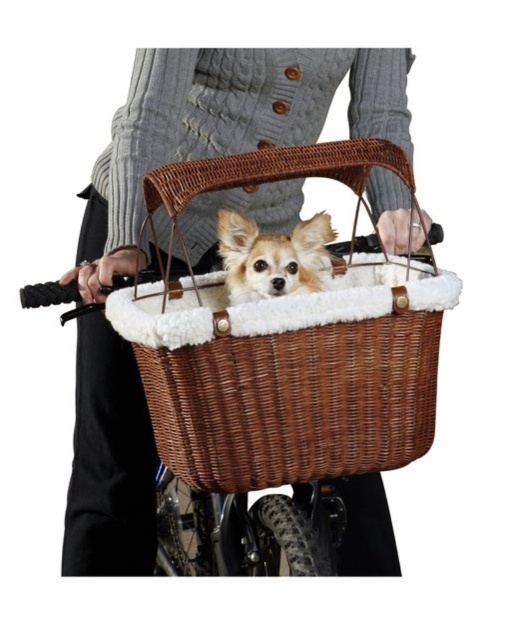
Question: Which of the following is the closest to the observer?

Choices:
 (A) (227, 214)
 (B) (425, 365)

Answer: (B)

Question: Is woven brown basket at center closer to the viewer compared to light brown fur dog at center?

Choices:
 (A) no
 (B) yes

Answer: (B)

Question: Can you confirm if woven brown basket at center is positioned to the left of light brown fur dog at center?

Choices:
 (A) yes
 (B) no

Answer: (B)

Question: Can you confirm if woven brown basket at center is positioned above light brown fur dog at center?

Choices:
 (A) no
 (B) yes

Answer: (A)

Question: Which of the following is the closest to the observer?

Choices:
 (A) light brown fur dog at center
 (B) woven brown basket at center

Answer: (B)